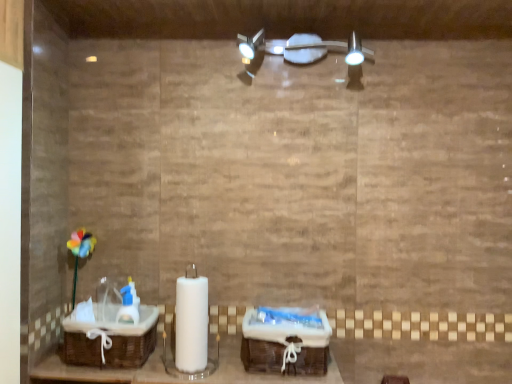
At what (x,y) coordinates should I click in order to perform the action: click on empty space that is ontop of woven brown baskets at center (from a real-world perspective). Please return your answer as a coordinate pair (x, y). Looking at the image, I should click on tap(200, 369).